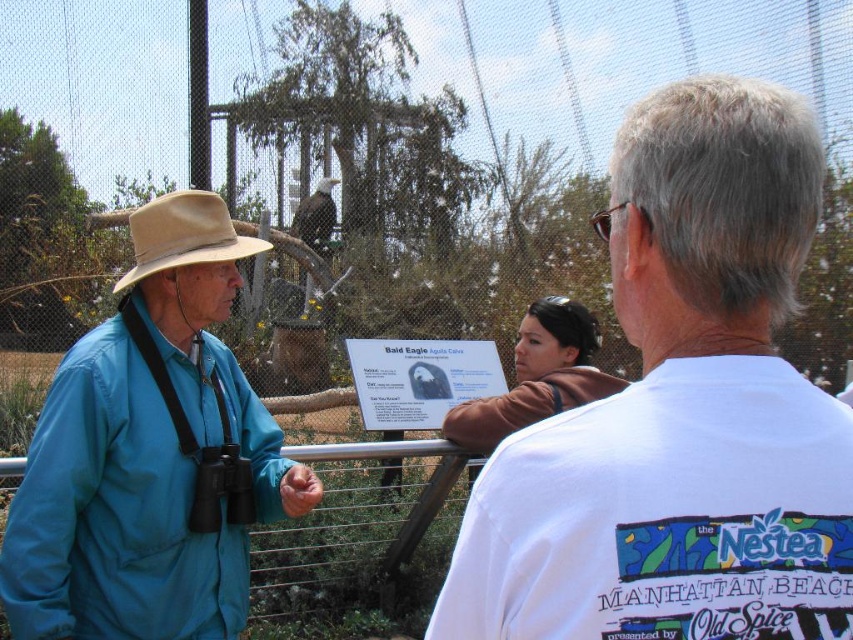
Question: Which of the following is the farthest from the observer?

Choices:
 (A) beige felt cowboy hat at left
 (B) brown fuzzy sweater at center
 (C) matte blue shirt at left
 (D) metal wire fence at center

Answer: (B)

Question: Which point is closer to the camera taking this photo?

Choices:
 (A) (192, 196)
 (B) (265, 449)

Answer: (A)

Question: Can you confirm if metal wire fence at center is wider than beige felt cowboy hat at left?

Choices:
 (A) yes
 (B) no

Answer: (A)

Question: Can you confirm if matte blue shirt at left is thinner than brown fuzzy sweater at center?

Choices:
 (A) no
 (B) yes

Answer: (A)

Question: Estimate the real-world distances between objects in this image. Which object is farther from the metal wire fence at center?

Choices:
 (A) matte blue shirt at left
 (B) brushed metal rail at center
 (C) brown fuzzy sweater at center
 (D) white cotton shirt at upper right

Answer: (D)

Question: Can you confirm if white cotton shirt at upper right is positioned below beige felt cowboy hat at left?

Choices:
 (A) no
 (B) yes

Answer: (B)